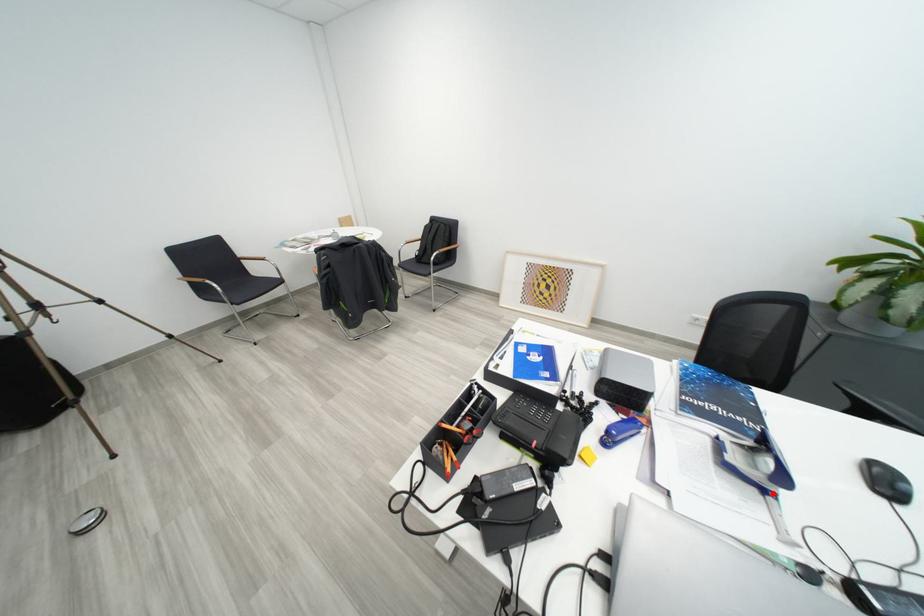
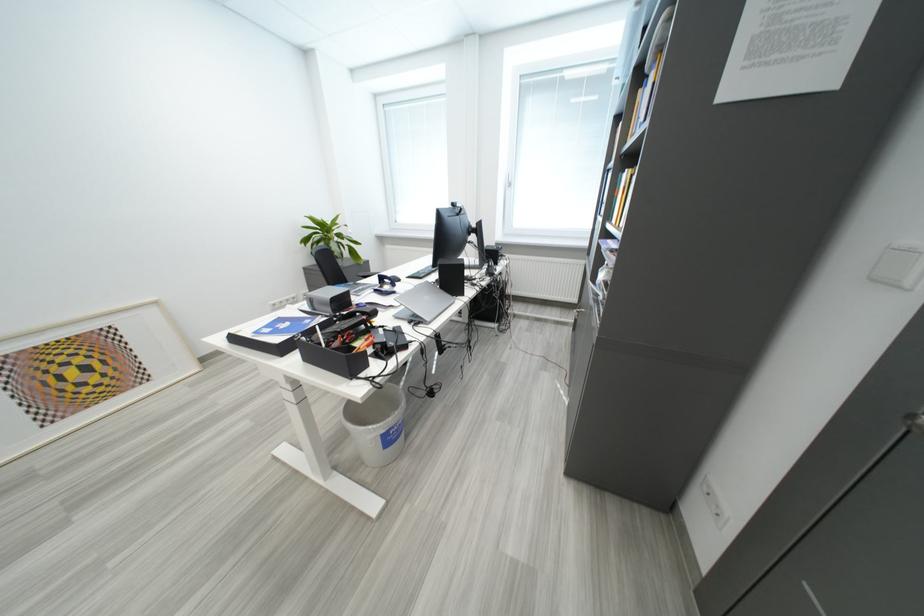
Where in the second image is the point corresponding to the highlighted location from the first image?

(403, 294)